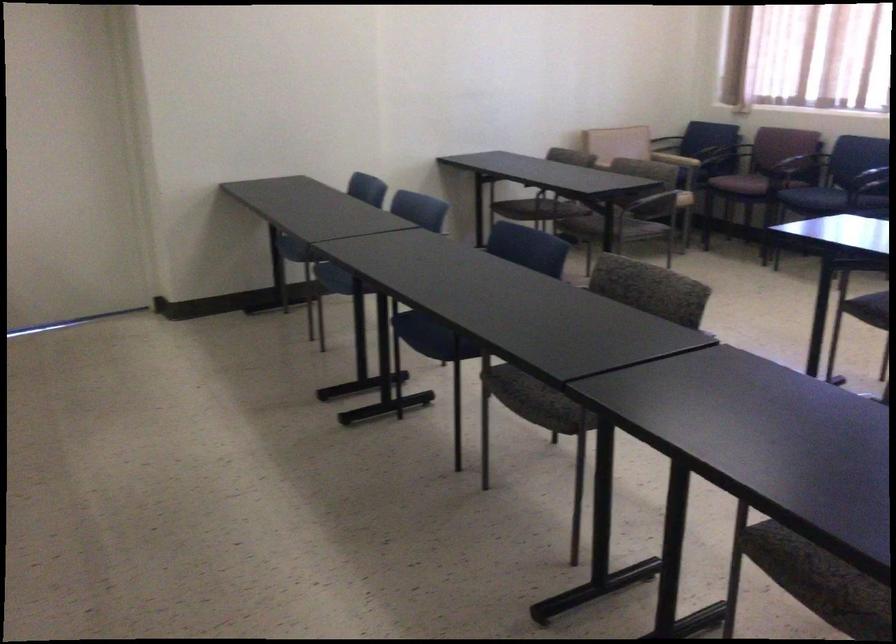
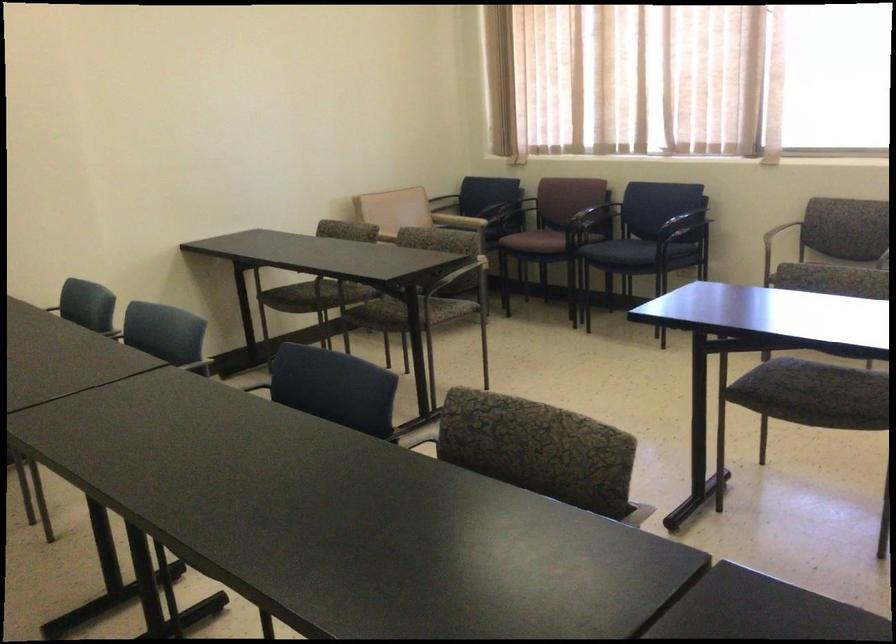
Question: Which direction would the cameraman need to move to produce the second image? Reply with the corresponding letter.

Choices:
 (A) Left
 (B) Right
 (C) Forward
 (D) Backward

Answer: (C)